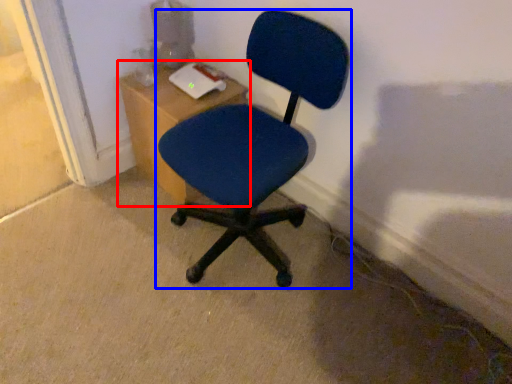
Question: Which object is further to the camera taking this photo, table (highlighted by a red box) or chair (highlighted by a blue box)?

Choices:
 (A) table
 (B) chair

Answer: (A)